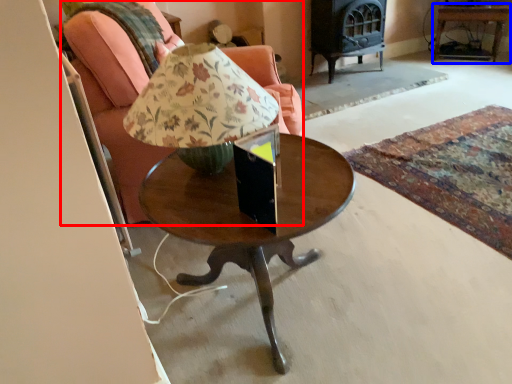
Question: Among these objects, which one is nearest to the camera, chair (highlighted by a red box) or side table (highlighted by a blue box)?

Choices:
 (A) chair
 (B) side table

Answer: (A)